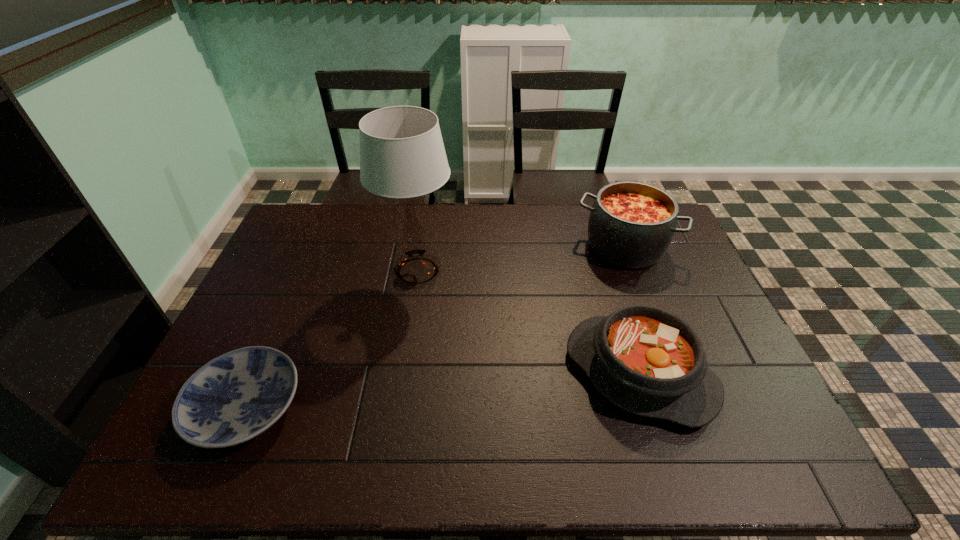
Where is `free space at the near edge of the desktop`? This screenshot has height=540, width=960. free space at the near edge of the desktop is located at coordinates (445, 455).

The height and width of the screenshot is (540, 960). What are the coordinates of `vacant space at the left edge of the desktop` in the screenshot? It's located at (233, 343).

Where is `vacant space at the far left corner of the desktop`? vacant space at the far left corner of the desktop is located at coordinates (324, 215).

Identify the location of free space between the shorter casserole and the tallest object. This screenshot has width=960, height=540. (528, 322).

Locate an element on the screen. The width and height of the screenshot is (960, 540). free space between the shortest object and the farther casserole is located at coordinates (436, 327).

Identify the location of unoccupied position between the leftmost object and the taller casserole. (436, 327).

You are a GUI agent. You are given a task and a screenshot of the screen. Output one action in this format:
    pyautogui.click(x=<x>, y=<y>)
    Task: Click on the free area in between the leftmost object and the third object from right to left
    
    Given the screenshot: What is the action you would take?
    pyautogui.click(x=332, y=339)

The height and width of the screenshot is (540, 960). What are the coordinates of `empty location between the plate and the third tallest object` in the screenshot? It's located at (443, 390).

This screenshot has width=960, height=540. Find the location of `free spot between the third object from right to left and the leftmost object`. free spot between the third object from right to left and the leftmost object is located at coordinates (332, 339).

This screenshot has width=960, height=540. In order to click on empty space between the farther casserole and the plate in this screenshot , I will do `click(436, 327)`.